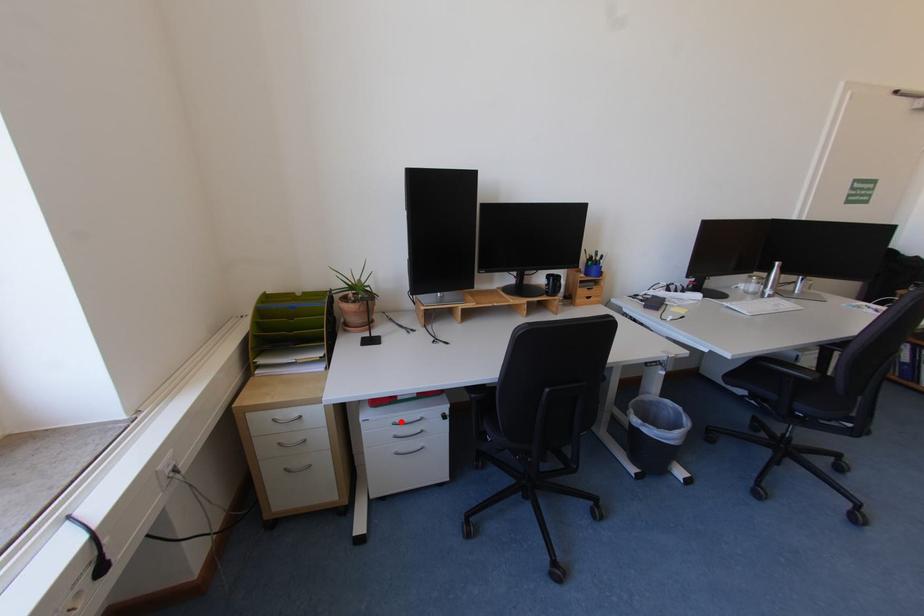
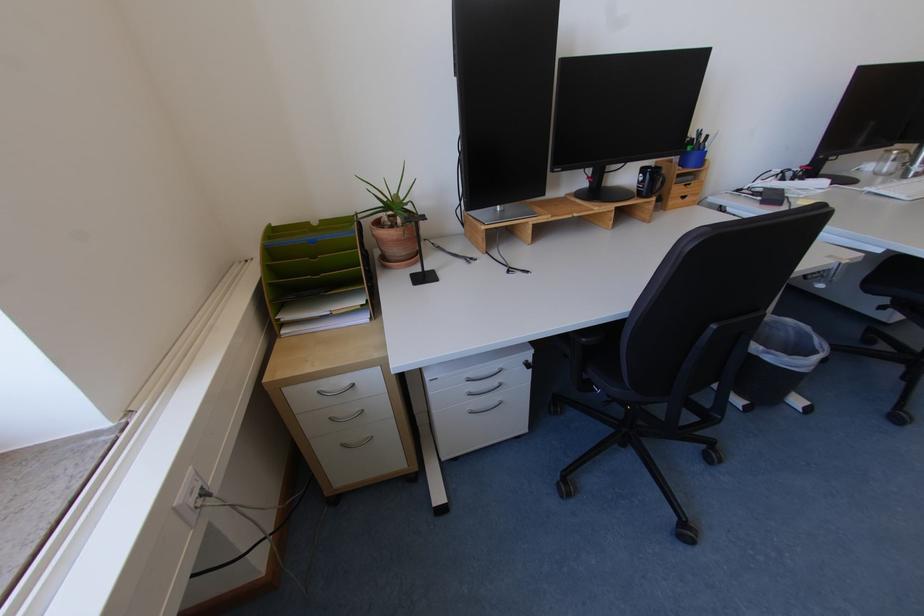
Where in the second image is the point corresponding to the highlighted location from the first image?

(475, 378)